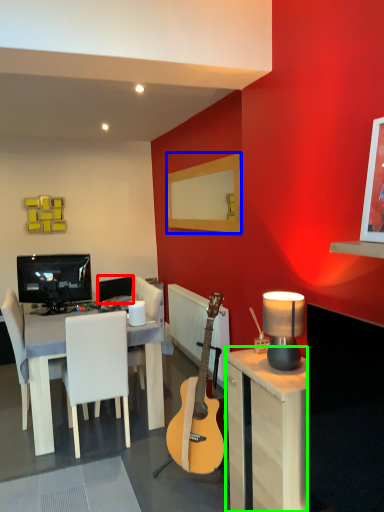
Question: Which object is the farthest from television (highlighted by a red box)? Choose among these: mirror (highlighted by a blue box) or desk (highlighted by a green box).

Choices:
 (A) mirror
 (B) desk

Answer: (B)